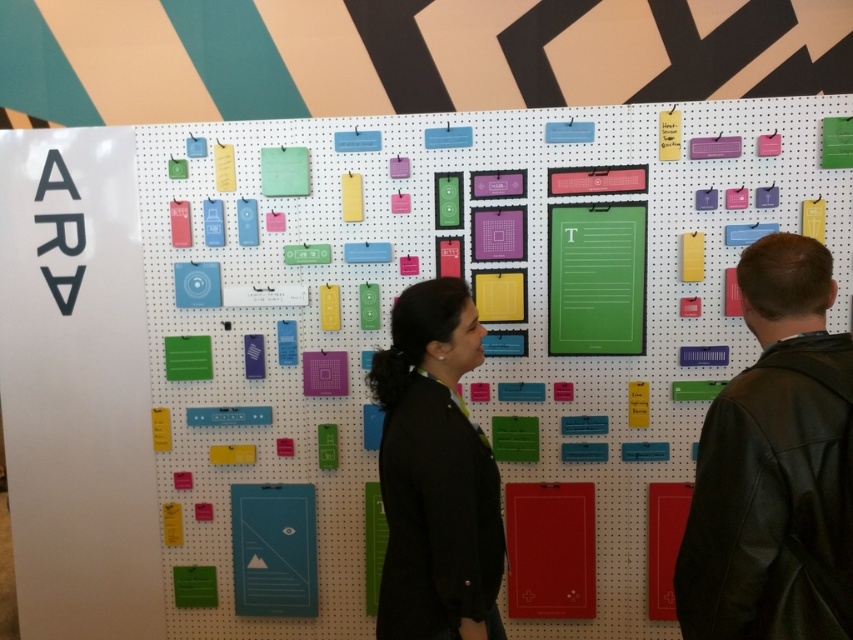
Question: Is black leather jacket at right wider than black matte jacket at center?

Choices:
 (A) no
 (B) yes

Answer: (A)

Question: Considering the relative positions of black leather jacket at right and black matte jacket at center in the image provided, where is black leather jacket at right located with respect to black matte jacket at center?

Choices:
 (A) right
 (B) left

Answer: (A)

Question: Which object appears closest to the camera in this image?

Choices:
 (A) black leather jacket at right
 (B) black matte jacket at center

Answer: (A)

Question: Can you confirm if black leather jacket at right is smaller than black matte jacket at center?

Choices:
 (A) no
 (B) yes

Answer: (B)

Question: Which of the following is the closest to the observer?

Choices:
 (A) black matte jacket at center
 (B) black leather jacket at right

Answer: (B)

Question: Which of the following is the closest to the observer?

Choices:
 (A) [474, 324]
 (B) [825, 612]

Answer: (B)